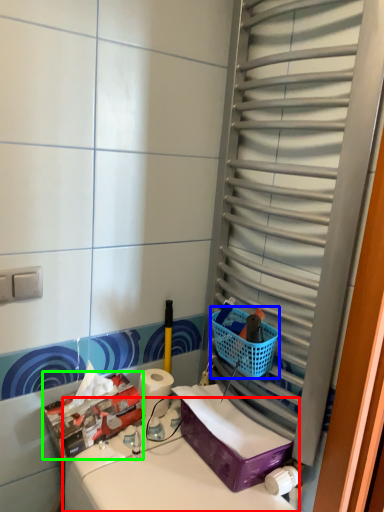
Question: Which object is positioned closest to counter top (highlighted by a red box)? Select from basket (highlighted by a blue box) and storage box (highlighted by a green box).

Choices:
 (A) basket
 (B) storage box

Answer: (B)